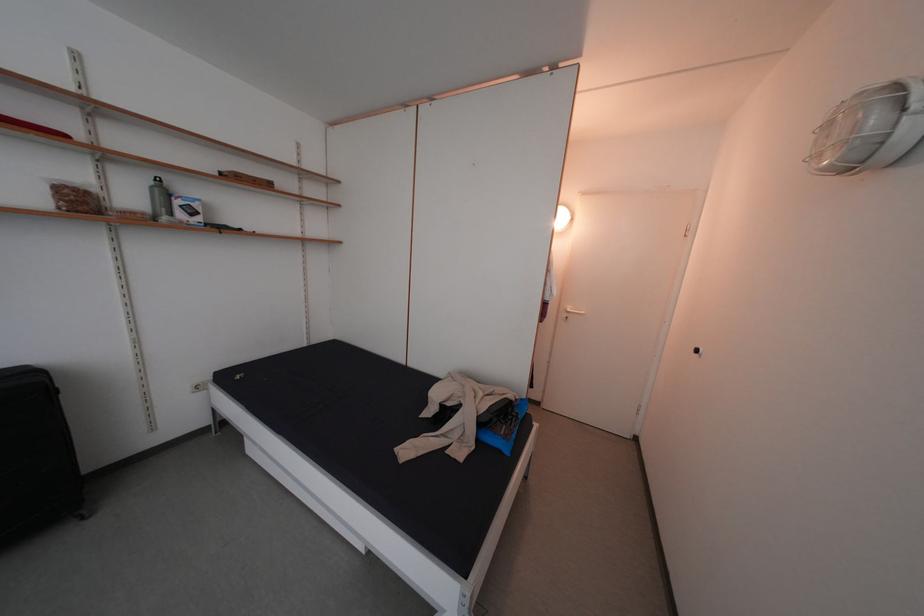
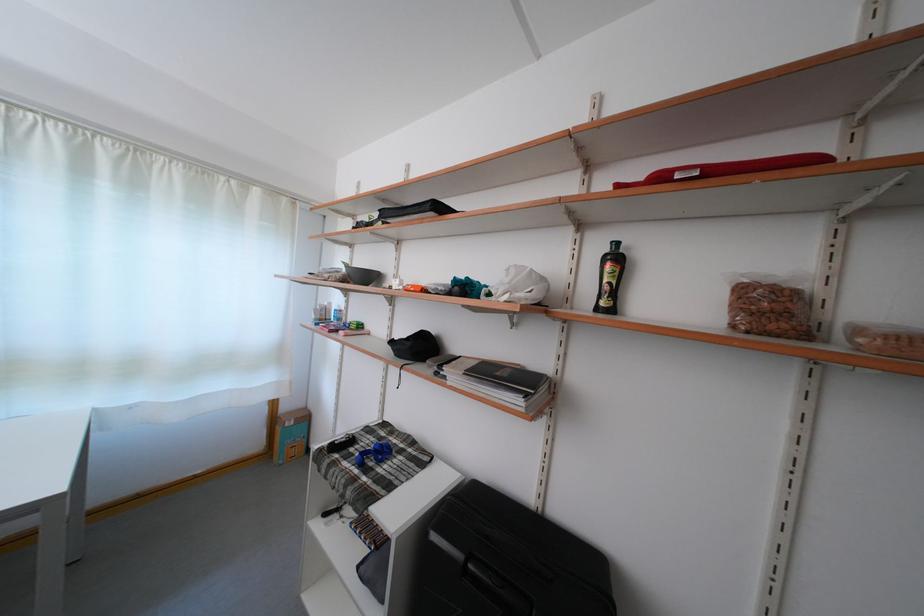
Where in the second image is the point corresponding to point 91,209 from the first image?

(782, 321)